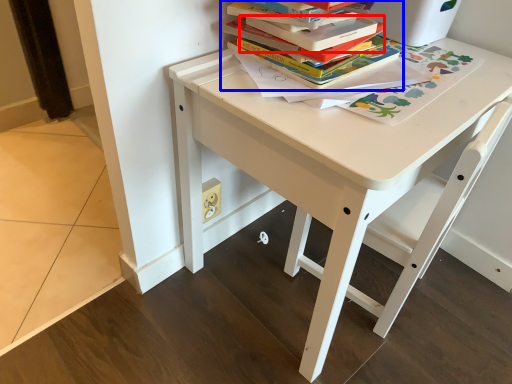
Question: Which point is closer to the camera, paperback book (highlighted by a red box) or book (highlighted by a blue box)?

Choices:
 (A) paperback book
 (B) book

Answer: (A)